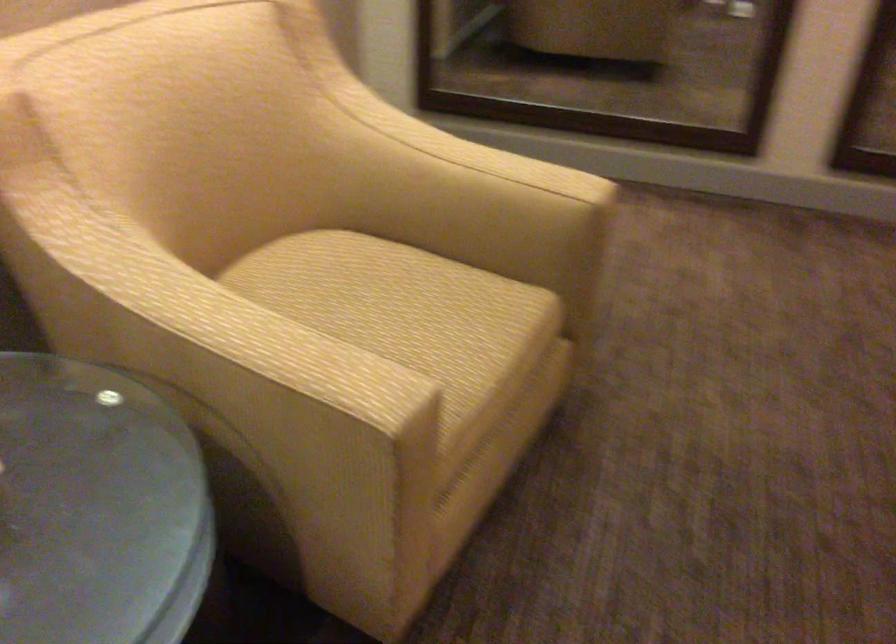
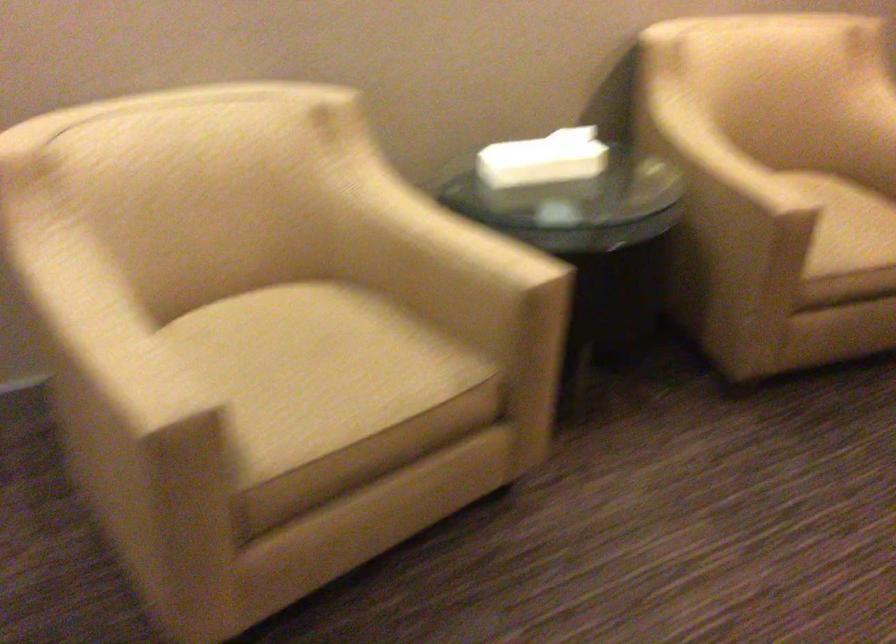
Where in the second image is the point corresponding to point (418, 341) from the first image?

(846, 225)